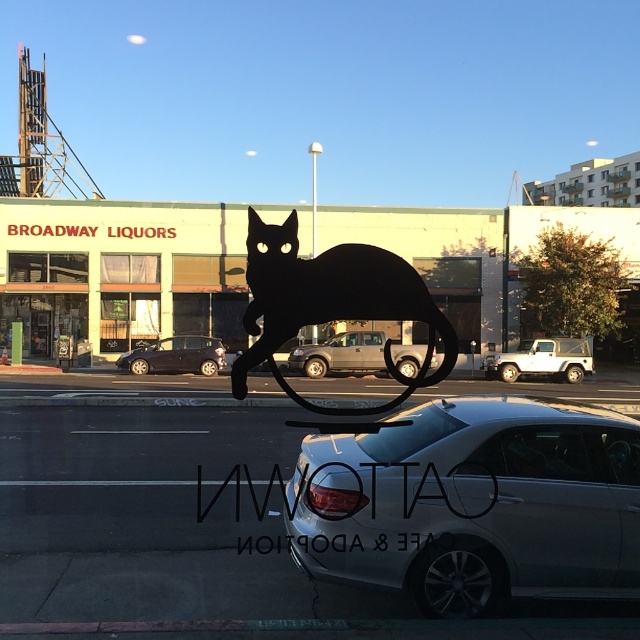
You are a delivery driver who needs to park your truck, which is 6 meters long, in this street scene. There is a satin silver sedan at center and a silver metallic suv at center in the way. Can your truck fit between them if you position it along the curb?

The satin silver sedan at center is smaller than the silver metallic suv at center, but without knowing the exact distance between them, it is impossible to determine if the truck can fit. More information is needed about the spacing between the two vehicles.

You are standing on the sidewalk and want to cross the street to reach the satin silver sedan at center. The crosswalk is 15 feet away from you. Can you safely reach the sedan before the crosswalk ends?

The satin silver sedan at center is 16.40 feet away from you, which is 1.4 feet beyond the crosswalk. You cannot safely reach it before the crosswalk ends.